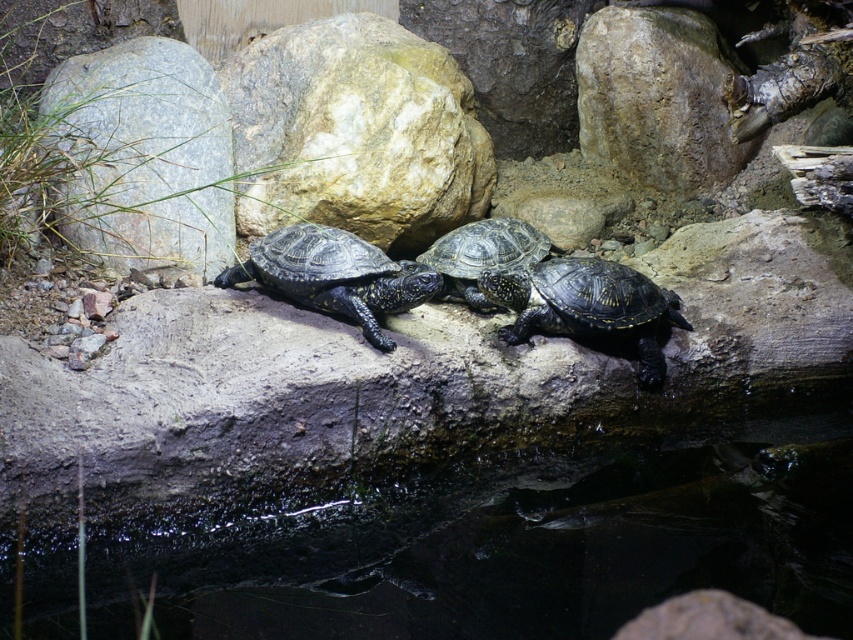
You are standing at the camera position and want to pick up the rough textured rock at upper center. Can you reach it without moving your feet?

The rough textured rock at upper center is 5.85 meters away from the camera, so you cannot reach it without moving your feet.

You are a zookeeper observing the turtles and rocks in the enclosure. You need to place a new feeding tray between the rough textured rock at upper center and the shiny black turtle at center. Based on their positions, where should the feeding tray be placed?

The feeding tray should be placed below the rough textured rock at upper center and above the shiny black turtle at center since the rough textured rock at upper center is located above the shiny black turtle at center.

You are a zookeeper who needs to place a feeding tray for the shiny black turtle at center. The tray must be placed within 1.5 meters of the turtle to ensure it can reach it. Is the gray rock at center too far away to place the tray there?

The distance between the gray rock at center and the shiny black turtle at center is 1.70 meters. Since the required distance is 1.5 meters, placing the tray at the gray rock at center would be too far for the turtle to reach.